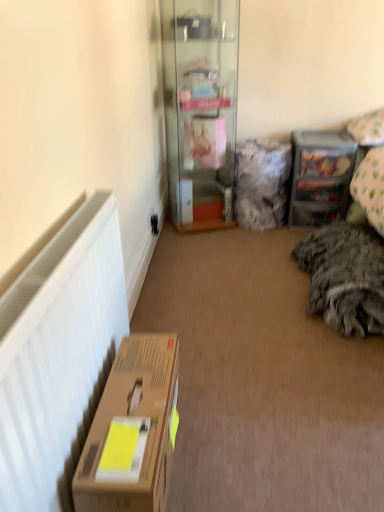
Question: Can you confirm if brown cardboard box at lower left is shorter than white fabric pillow at upper right, acting as the second pillow starting from the left?

Choices:
 (A) yes
 (B) no

Answer: (B)

Question: Is brown cardboard box at lower left positioned before white fabric pillow at upper right, acting as the second pillow starting from the left?

Choices:
 (A) yes
 (B) no

Answer: (A)

Question: Considering the relative positions of brown cardboard box at lower left and white fabric pillow at upper right, the first pillow when ordered from right to left, in the image provided, is brown cardboard box at lower left to the right of white fabric pillow at upper right, the first pillow when ordered from right to left, from the viewer's perspective?

Choices:
 (A) no
 (B) yes

Answer: (A)

Question: From the image's perspective, is brown cardboard box at lower left under white fabric pillow at upper right, the first pillow when ordered from right to left?

Choices:
 (A) no
 (B) yes

Answer: (B)

Question: From a real-world perspective, does brown cardboard box at lower left sit lower than white fabric pillow at upper right, acting as the second pillow starting from the left?

Choices:
 (A) no
 (B) yes

Answer: (B)

Question: Does brown cardboard box at lower left come behind white fabric pillow at upper right, the first pillow when ordered from right to left?

Choices:
 (A) yes
 (B) no

Answer: (B)

Question: From the image's perspective, is fuzzy fabric pillow at center, which ranks as the 2th pillow in right-to-left order, on white matte radiator at left?

Choices:
 (A) no
 (B) yes

Answer: (B)

Question: Considering the relative positions of fuzzy fabric pillow at center, which ranks as the 2th pillow in right-to-left order, and white matte radiator at left in the image provided, is fuzzy fabric pillow at center, which ranks as the 2th pillow in right-to-left order, in front of white matte radiator at left?

Choices:
 (A) yes
 (B) no

Answer: (B)

Question: Is fuzzy fabric pillow at center, which ranks as the 2th pillow in right-to-left order, facing away from white matte radiator at left?

Choices:
 (A) yes
 (B) no

Answer: (B)

Question: Does fuzzy fabric pillow at center, which ranks as the 2th pillow in right-to-left order, have a greater height compared to white matte radiator at left?

Choices:
 (A) no
 (B) yes

Answer: (B)

Question: Does fuzzy fabric pillow at center, which ranks as the 2th pillow in right-to-left order, have a greater width compared to white matte radiator at left?

Choices:
 (A) yes
 (B) no

Answer: (A)

Question: Could you tell me if fuzzy fabric pillow at center, which ranks as the 2th pillow in right-to-left order, is facing white matte radiator at left?

Choices:
 (A) yes
 (B) no

Answer: (B)

Question: Considering the relative sizes of brown cardboard box at lower left and clear plastic drawers at upper right in the image provided, is brown cardboard box at lower left taller than clear plastic drawers at upper right?

Choices:
 (A) yes
 (B) no

Answer: (B)